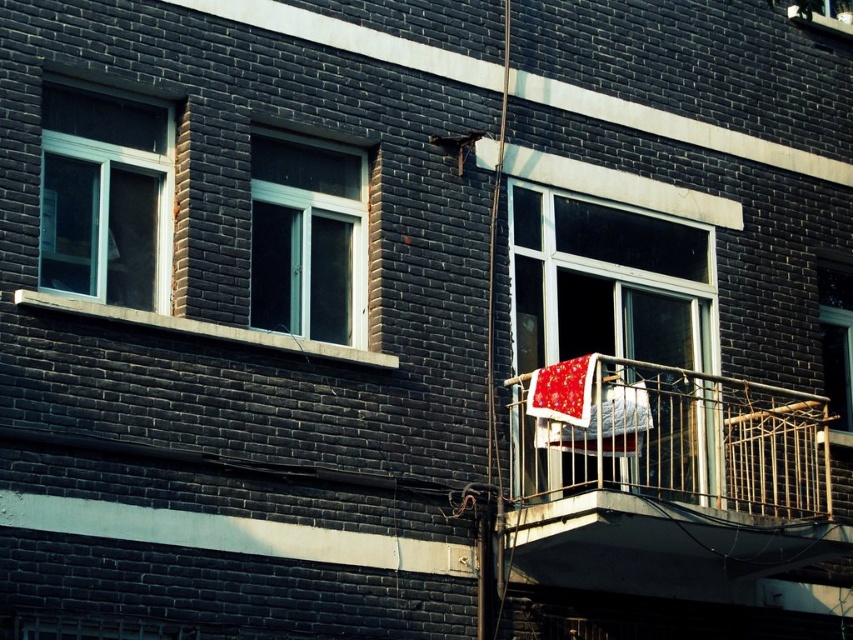
Does metallic railing at right appear on the left side of clear glass window at center?

In fact, metallic railing at right is to the right of clear glass window at center.

Does metallic railing at right have a greater width compared to clear glass window at center?

Yes, metallic railing at right is wider than clear glass window at center.

What do you see at coordinates (670, 483) in the screenshot? I see `metallic railing at right` at bounding box center [670, 483].

What are the coordinates of `metallic railing at right` in the screenshot? It's located at (670, 483).

The image size is (853, 640). Describe the element at coordinates (105, 196) in the screenshot. I see `clear glass window at upper left` at that location.

You are a GUI agent. You are given a task and a screenshot of the screen. Output one action in this format:
    pyautogui.click(x=<x>, y=<y>)
    Task: Click on the clear glass window at upper left
    This screenshot has width=853, height=640.
    Given the screenshot: What is the action you would take?
    pyautogui.click(x=105, y=196)

Who is more forward, (83, 291) or (332, 326)?

Point (83, 291) is more forward.

Where is `clear glass window at upper left`? clear glass window at upper left is located at coordinates (105, 196).

Does point (705, 529) lie in front of point (293, 214)?

No, it is behind (293, 214).

Is metallic railing at right to the left of white plastic window at center from the viewer's perspective?

Incorrect, metallic railing at right is not on the left side of white plastic window at center.

Is point (534, 496) positioned in front of point (323, 163)?

Yes, point (534, 496) is in front of point (323, 163).

Locate an element on the screen. metallic railing at right is located at coordinates (670, 483).